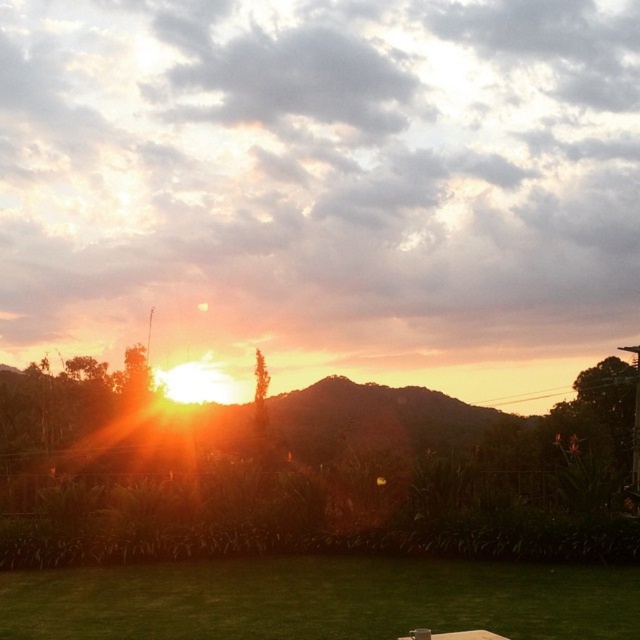
You are planning to set up a tent for a small gathering. You have a tent that requires a space of 20 feet between the green grass at lower center and the brown wooden picnic table at center. Is there enough space?

The green grass at lower center is 25.31 feet from the brown wooden picnic table at center, so yes, there is enough space for the tent since the required distance is 20 feet.

You are planning to set up a small tent for a picnic. The green grass at lower center and brown wooden picnic table at center are both in your view. Which area has more space to accommodate the tent?

The green grass at lower center has more space because its width surpasses that of the brown wooden picnic table at center.